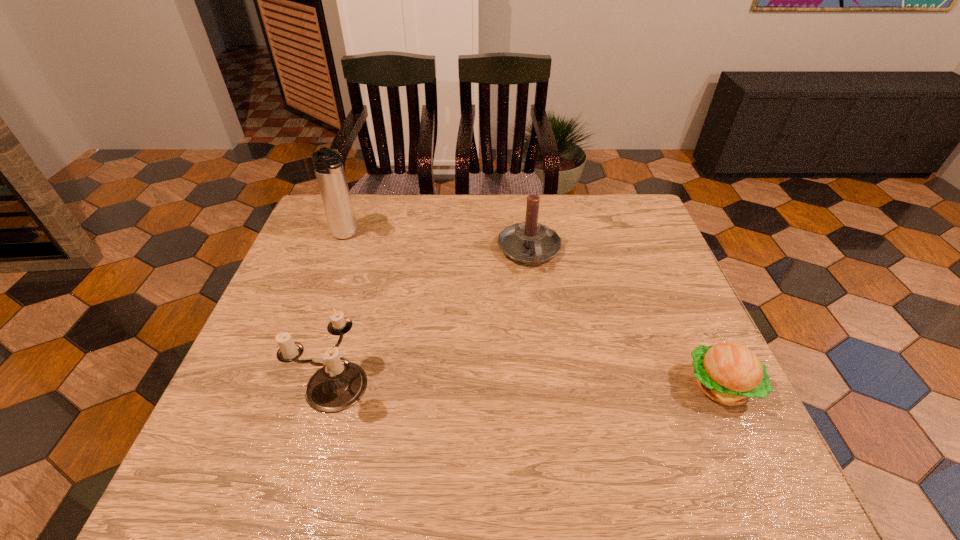
Where is `free space that is in between the hamburger and the candle`? This screenshot has height=540, width=960. free space that is in between the hamburger and the candle is located at coordinates (625, 318).

Where is `free space between the candle holder and the tallest object`? The image size is (960, 540). free space between the candle holder and the tallest object is located at coordinates (340, 310).

Locate an element on the screen. vacant region between the candle holder and the rightmost object is located at coordinates pos(527,385).

I want to click on free space between the candle holder and the rightmost object, so click(x=527, y=385).

Where is `free spot between the thermos bottle and the rightmost object`? The image size is (960, 540). free spot between the thermos bottle and the rightmost object is located at coordinates click(534, 310).

You are a GUI agent. You are given a task and a screenshot of the screen. Output one action in this format:
    pyautogui.click(x=<x>, y=<y>)
    Task: Click on the free spot between the rightmost object and the candle holder
    Image resolution: width=960 pixels, height=540 pixels.
    Given the screenshot: What is the action you would take?
    pyautogui.click(x=527, y=385)

Find the location of a particular element. This screenshot has width=960, height=540. free space between the third object from left to right and the shortest object is located at coordinates (625, 318).

Where is `the second closest object to the third object from left to right`? the second closest object to the third object from left to right is located at coordinates (339, 384).

Identify which object is located as the nearest to the tallest object. Please provide its 2D coordinates. Your answer should be formatted as a tuple, i.e. [(x, y)], where the tuple contains the x and y coordinates of a point satisfying the conditions above.

[(339, 384)]

The image size is (960, 540). Find the location of `free point that satisfies the following two spatial constraints: 1. on the front side of the hamburger; 2. on the left side of the tallest object`. free point that satisfies the following two spatial constraints: 1. on the front side of the hamburger; 2. on the left side of the tallest object is located at coordinates (293, 386).